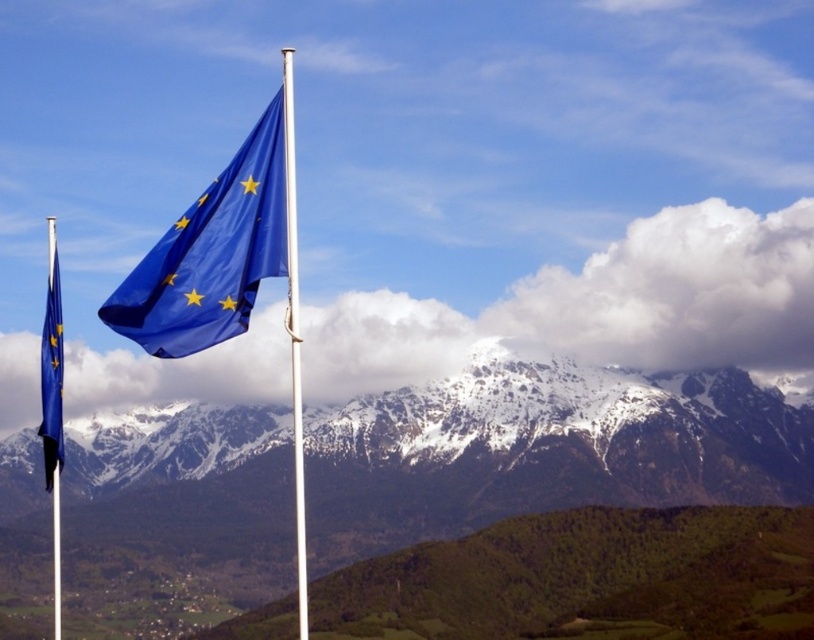
You are a photographer planning to capture the European Union flags against the snowy mountain backdrop. You notice the blue fabric flag at upper center and the matte blue flag at left. Which flag should you focus on to ensure it stands out more due to its size in the photo?

The blue fabric flag at upper center is larger in size than the matte blue flag at left, so focusing on it will make it stand out more in the photo.

You are a drone operator planning to fly a drone between the white metallic flag pole at center and the matte blue flag at left. The drone has a maximum flight range of 100 meters. Can the drone safely complete the flight between these two points without running out of battery?

The white metallic flag pole at center and matte blue flag at left are 100.99 meters apart. Since the drone has a maximum flight range of 100 meters, it cannot safely complete the flight between these two points without running out of battery.